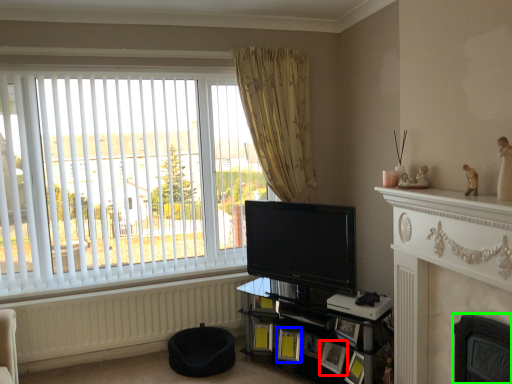
Question: Which object is positioned farthest from picture frame (highlighted by a red box)? Select from picture frame (highlighted by a blue box) and fireplace (highlighted by a green box).

Choices:
 (A) picture frame
 (B) fireplace

Answer: (B)